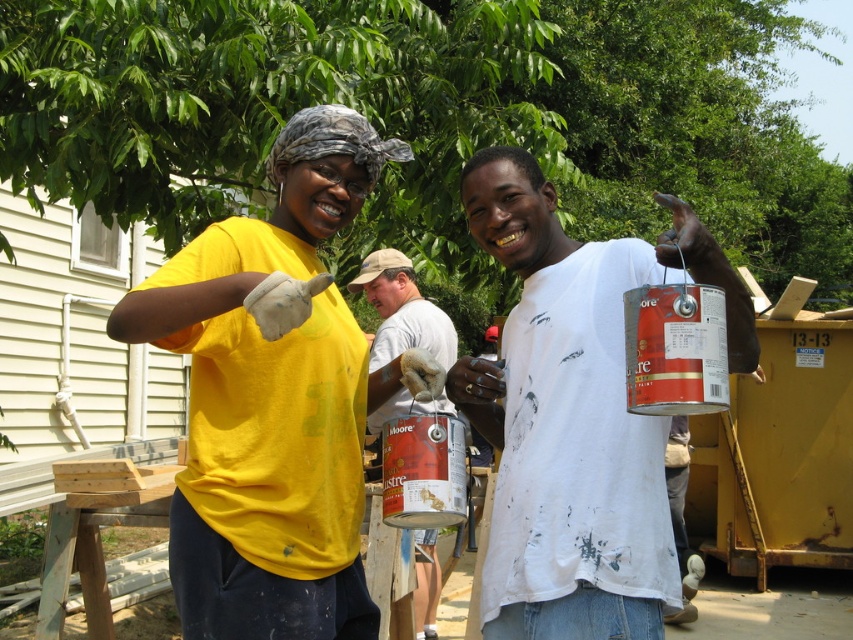
You are a painter standing 30 inches away from the matte gray shirt at center. Can you reach the yellow fabric shirt at upper left without moving?

The distance between the yellow fabric shirt at upper left and the matte gray shirt at center is 29.50 inches. Since you are standing 30 inches away from the matte gray shirt at center, you are just slightly farther than the distance between them. Therefore, you cannot reach the yellow fabric shirt at upper left without moving closer.

You are an architect designing a blueprint for a new house. You need to place a new window at coordinates that are exactly 0.5 units away from the yellow fabric shirt at upper left. What are the coordinates for the new window?

The coordinates for the new window would be either 0.623 plus or minus 0.5 in the x or y direction, but since the scene is within a 1x1 unit, the valid coordinates would be either x 1.123 or 0.123 and y 0.824 or 0.324. However, since coordinates can only be between 0 and 1, the valid options are x 0.123 or y 0.824. But without knowing the direction, it can be any of those positions within the scene boundaries.